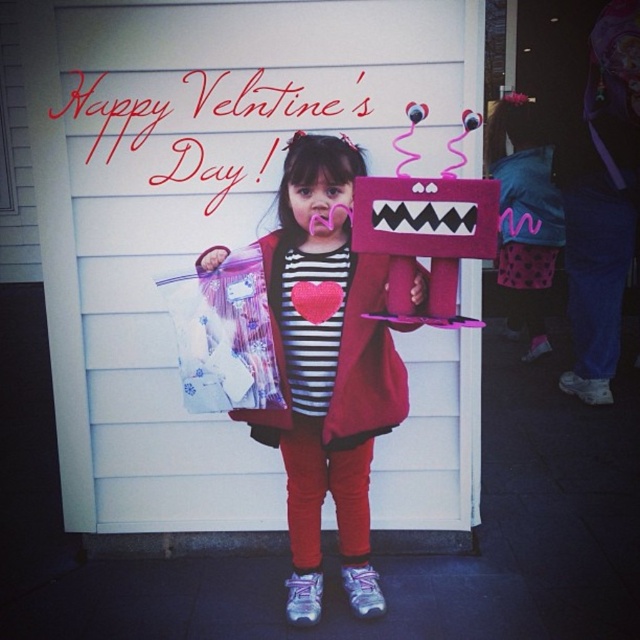
Question: Does white wood garage door at center appear over matte pink plush toy at center?

Choices:
 (A) yes
 (B) no

Answer: (A)

Question: Can you confirm if white wood garage door at center is smaller than matte pink plush toy at center?

Choices:
 (A) no
 (B) yes

Answer: (A)

Question: Is white wood garage door at center further to camera compared to matte pink plush toy at center?

Choices:
 (A) yes
 (B) no

Answer: (A)

Question: Which point is closer to the camera?

Choices:
 (A) (385, 259)
 (B) (360, 220)

Answer: (B)

Question: Among these points, which one is farthest from the camera?

Choices:
 (A) (426, 252)
 (B) (136, 54)
 (C) (380, 388)

Answer: (B)

Question: Estimate the real-world distances between objects in this image. Which object is closer to the matte pink plush toy at center?

Choices:
 (A) felt plush toy at center
 (B) white wood garage door at center

Answer: (A)